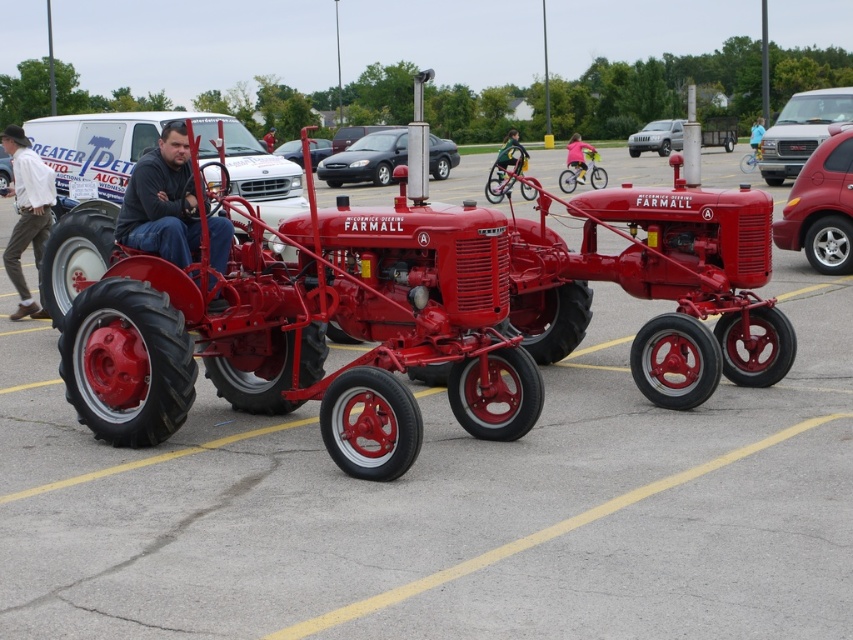
You are organizing a parade route and need to know if the white glossy van at left can fit through an alleyway that is just wide enough for the matte black pants at center. Based on their sizes, will the van fit?

The white glossy van at left is larger than the matte black pants at center, so it may not fit through the alleyway designed for the size of the matte black pants at center.

You are standing at point [764,131] and want to walk towards the bright red McCormick Deering Farmall tractor. Which direction should you go relative to point [263,228]?

You should walk towards point [263,228], which is in front of point [764,131], to reach the tractor.